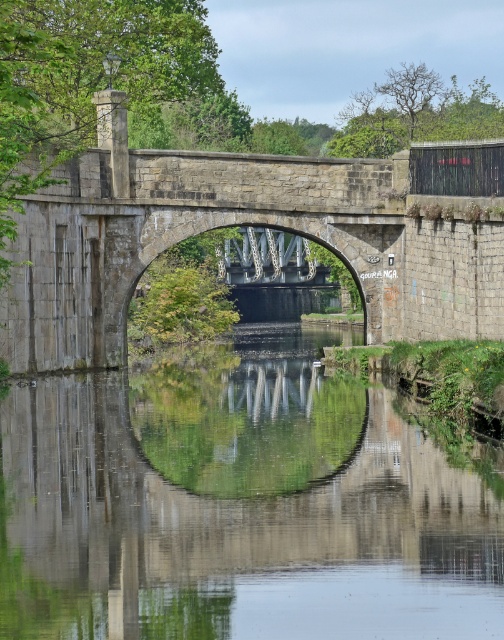
Measure the distance between point (x=275, y=529) and camera.

Point (x=275, y=529) and camera are 181.61 feet apart.

Who is more distant from viewer, (120, 372) or (495, 337)?

The point (120, 372) is more distant.

Locate an element on the screen. transparent water at center is located at coordinates (239, 506).